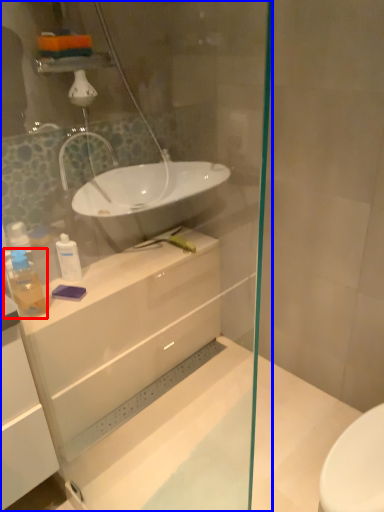
Question: Which object appears closest to the camera in this image, toiletry (highlighted by a red box) or shower door (highlighted by a blue box)?

Choices:
 (A) toiletry
 (B) shower door

Answer: (B)